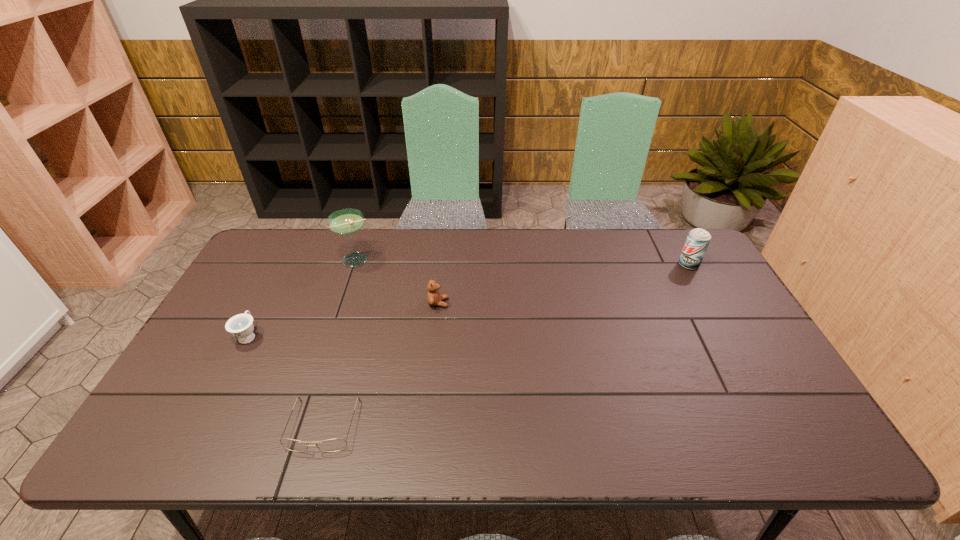
You are a GUI agent. You are given a task and a screenshot of the screen. Output one action in this format:
    pyautogui.click(x=<x>, y=<y>)
    Task: Click on the vacant space that's between the shortest object and the leftmost object
    The height and width of the screenshot is (540, 960).
    Given the screenshot: What is the action you would take?
    pyautogui.click(x=286, y=380)

This screenshot has height=540, width=960. What are the coordinates of `free spot between the fourth farthest object and the beer can` in the screenshot? It's located at (468, 300).

This screenshot has height=540, width=960. Find the location of `unoccupied position between the third shortest object and the nearest object`. unoccupied position between the third shortest object and the nearest object is located at coordinates (380, 364).

The height and width of the screenshot is (540, 960). Find the location of `free point between the beer can and the teacup`. free point between the beer can and the teacup is located at coordinates (468, 300).

Identify the location of free space between the leftmost object and the tallest object. (302, 298).

Find the location of `vacant space that is in between the nearest object and the tallest object`. vacant space that is in between the nearest object and the tallest object is located at coordinates (340, 342).

Locate an element on the screen. The image size is (960, 540). vacant space that is in between the second tallest object and the fourth farthest object is located at coordinates (468, 300).

Where is `the fourth closest object relative to the leftmost object`? The image size is (960, 540). the fourth closest object relative to the leftmost object is located at coordinates (698, 239).

Image resolution: width=960 pixels, height=540 pixels. In order to click on the third closest object to the tallest object in this screenshot , I will do `click(331, 445)`.

At what (x,y) coordinates should I click in order to perform the action: click on free spot that satisfies the following two spatial constraints: 1. on the side of the second shortest object with the handle; 2. on the right side of the second tallest object. Please return your answer as a coordinate pair (x, y). This screenshot has width=960, height=540. Looking at the image, I should click on (285, 265).